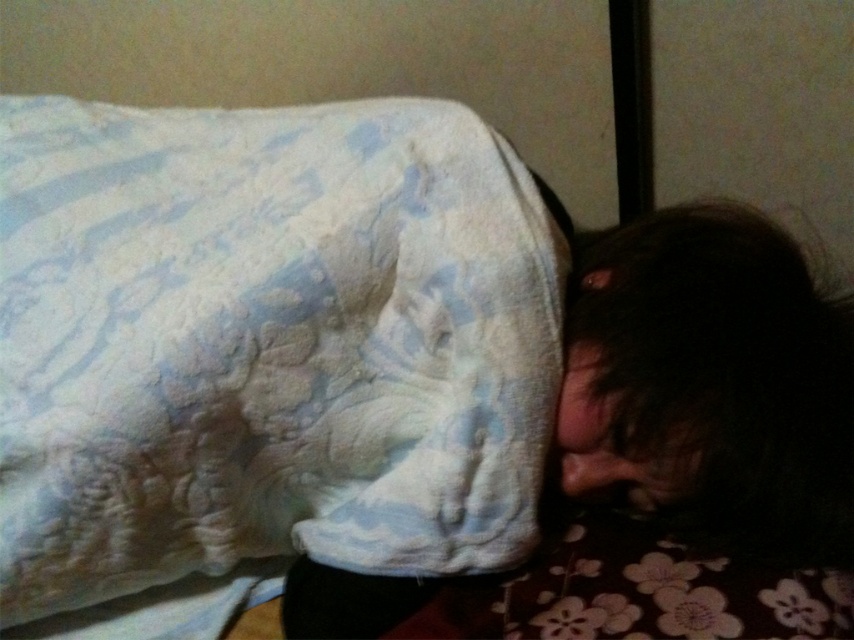
Question: Among these points, which one is farthest from the camera?

Choices:
 (A) 647,401
 (B) 607,410

Answer: (B)

Question: Is fluffy white blanket at upper left positioned in front of dark hair at lower right?

Choices:
 (A) yes
 (B) no

Answer: (A)

Question: Observing the image, what is the correct spatial positioning of dark hair at lower right in reference to dark matte hair at lower right?

Choices:
 (A) above
 (B) below

Answer: (A)

Question: Can you confirm if dark hair at lower right is thinner than dark matte hair at lower right?

Choices:
 (A) yes
 (B) no

Answer: (B)

Question: Which of the following is the farthest from the observer?

Choices:
 (A) dark matte hair at lower right
 (B) dark hair at lower right
 (C) fluffy white blanket at upper left

Answer: (A)

Question: Considering the real-world distances, which object is farthest from the dark hair at lower right?

Choices:
 (A) dark matte hair at lower right
 (B) fluffy white blanket at upper left

Answer: (B)